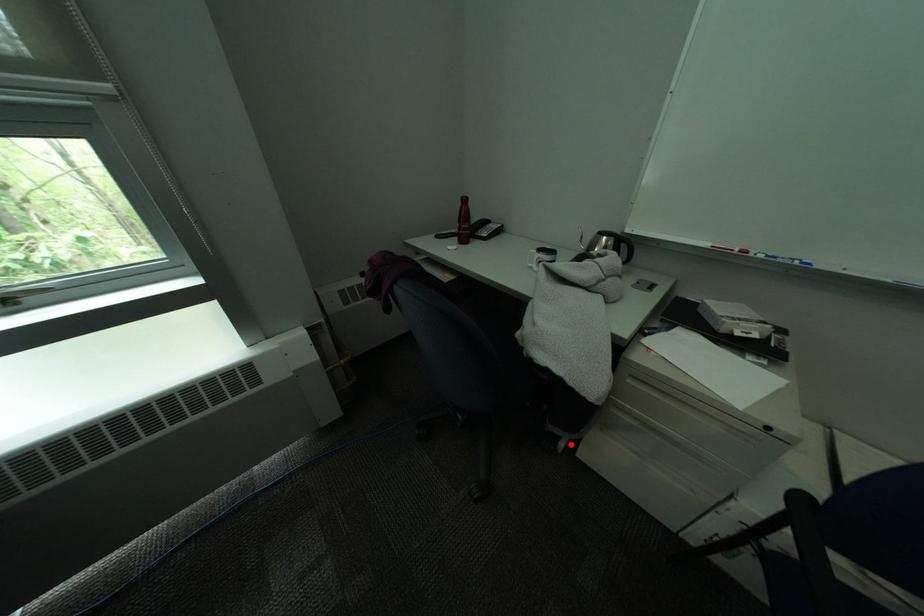
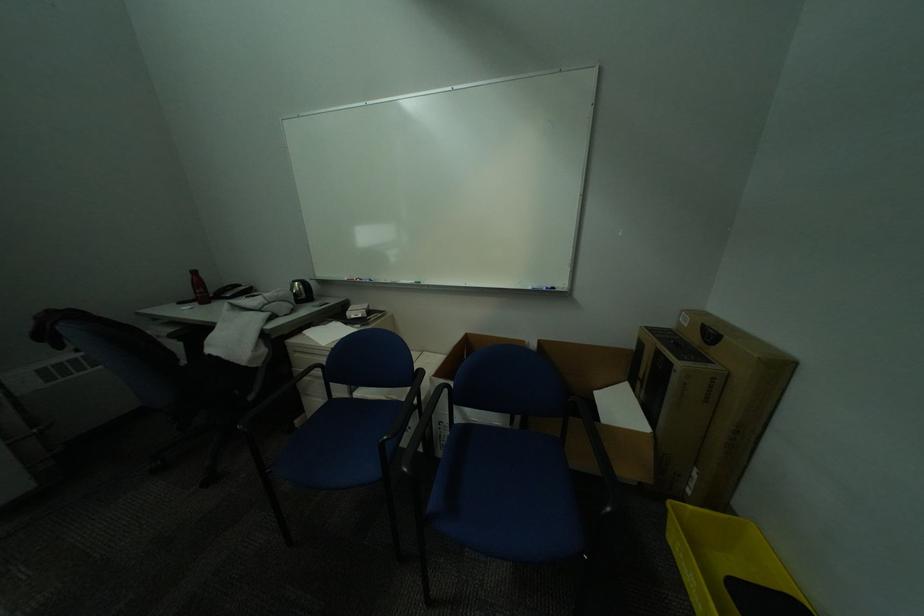
The point at the highlighted location is marked in the first image. Where is the corresponding point in the second image?

(306, 423)